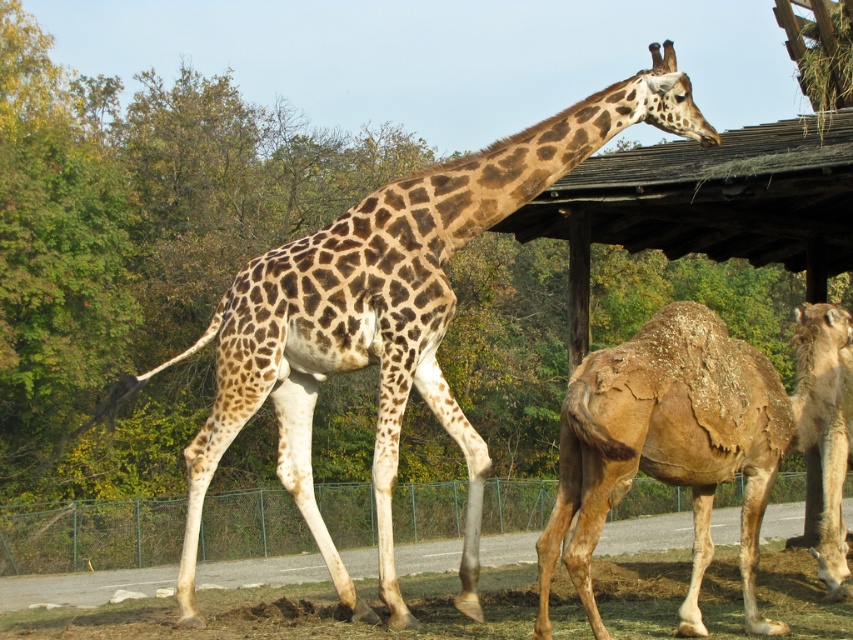
Question: Does brown textured camel at right appear over metallic wire fence at lower center?

Choices:
 (A) no
 (B) yes

Answer: (B)

Question: Considering the relative positions of spotted fur giraffe at center and metallic wire fence at lower center in the image provided, where is spotted fur giraffe at center located with respect to metallic wire fence at lower center?

Choices:
 (A) above
 (B) below

Answer: (A)

Question: Which point is closer to the camera?

Choices:
 (A) (730, 488)
 (B) (380, 317)

Answer: (B)

Question: Which point appears closest to the camera in this image?

Choices:
 (A) (635, 92)
 (B) (285, 492)

Answer: (A)

Question: Which object is the farthest from the spotted fur giraffe at center?

Choices:
 (A) brown textured camel at right
 (B) metallic wire fence at lower center

Answer: (B)

Question: Is spotted fur giraffe at center positioned behind metallic wire fence at lower center?

Choices:
 (A) yes
 (B) no

Answer: (A)